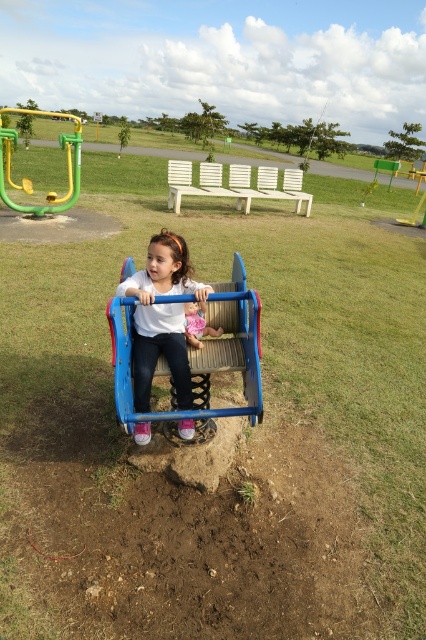
Question: Is white matte shirt at center thinner than smooth pink doll at center?

Choices:
 (A) yes
 (B) no

Answer: (B)

Question: Which point is farther to the camera?

Choices:
 (A) (134, 392)
 (B) (71, 204)
 (C) (193, 316)

Answer: (B)

Question: Which of these objects is positioned farthest from the smooth pink doll at center?

Choices:
 (A) white matte shirt at center
 (B) green plastic monkey bars at upper left

Answer: (B)

Question: Which point is farther from the camera taking this photo?

Choices:
 (A) (x=69, y=184)
 (B) (x=204, y=305)
 (C) (x=187, y=397)

Answer: (A)

Question: Is green plastic monkey bars at upper left to the right of smooth pink doll at center from the viewer's perspective?

Choices:
 (A) no
 (B) yes

Answer: (A)

Question: Can you confirm if white matte shirt at center is wider than green plastic monkey bars at upper left?

Choices:
 (A) no
 (B) yes

Answer: (A)